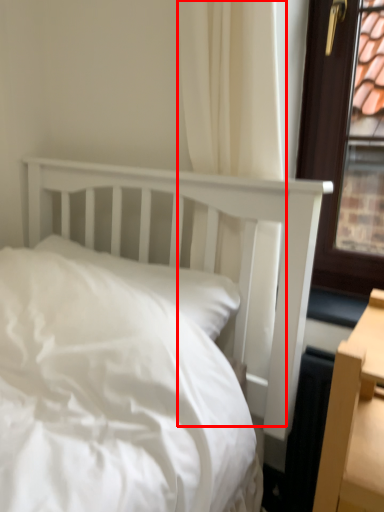
Question: From the image's perspective, what is the correct spatial relationship of curtain (annotated by the red box) in relation to pillow?

Choices:
 (A) below
 (B) above

Answer: (B)